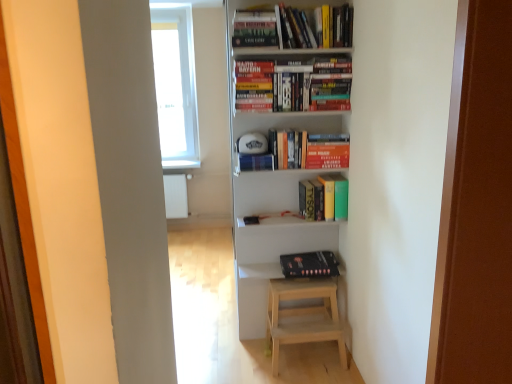
Question: Is black matte book at lower center, which appears as the 4th book when viewed from the top, at the back of hardcover books at upper center, which is counted as the first book, starting from the top?

Choices:
 (A) no
 (B) yes

Answer: (A)

Question: Does hardcover books at upper center, the 4th book from the bottom, appear on the right side of black matte book at lower center, which appears as the 4th book when viewed from the top?

Choices:
 (A) yes
 (B) no

Answer: (B)

Question: Considering the relative sizes of hardcover books at upper center, which is counted as the first book, starting from the top, and black matte book at lower center, arranged as the 1th book when ordered from the bottom, in the image provided, is hardcover books at upper center, which is counted as the first book, starting from the top, thinner than black matte book at lower center, arranged as the 1th book when ordered from the bottom,?

Choices:
 (A) yes
 (B) no

Answer: (A)

Question: Could you tell me if hardcover books at upper center, which is counted as the first book, starting from the top, is facing black matte book at lower center, arranged as the 1th book when ordered from the bottom?

Choices:
 (A) no
 (B) yes

Answer: (A)

Question: Is hardcover books at upper center, the 4th book from the bottom, located outside black matte book at lower center, which appears as the 4th book when viewed from the top?

Choices:
 (A) yes
 (B) no

Answer: (A)

Question: From a real-world perspective, is hardcover books at upper center, which is counted as the first book, starting from the top, located beneath black matte book at lower center, arranged as the 1th book when ordered from the bottom?

Choices:
 (A) no
 (B) yes

Answer: (A)

Question: Considering the relative positions of black matte book at lower center, which appears as the 4th book when viewed from the top, and hardcover books at upper center, which is the 3th book from bottom to top, in the image provided, is black matte book at lower center, which appears as the 4th book when viewed from the top, to the right of hardcover books at upper center, which is the 3th book from bottom to top, from the viewer's perspective?

Choices:
 (A) yes
 (B) no

Answer: (A)

Question: Does black matte book at lower center, which appears as the 4th book when viewed from the top, have a lesser height compared to hardcover books at upper center, which is the 3th book from bottom to top?

Choices:
 (A) no
 (B) yes

Answer: (B)

Question: Is the depth of black matte book at lower center, arranged as the 1th book when ordered from the bottom, greater than that of hardcover books at upper center, which is the 3th book from bottom to top?

Choices:
 (A) yes
 (B) no

Answer: (A)

Question: Can you confirm if black matte book at lower center, which appears as the 4th book when viewed from the top, is bigger than hardcover books at upper center, which is the 3th book from bottom to top?

Choices:
 (A) no
 (B) yes

Answer: (A)

Question: From a real-world perspective, does black matte book at lower center, arranged as the 1th book when ordered from the bottom, stand above hardcover books at upper center, marked as the 2th book in a top-to-bottom arrangement?

Choices:
 (A) yes
 (B) no

Answer: (B)

Question: Can you confirm if black matte book at lower center, which appears as the 4th book when viewed from the top, is wider than hardcover books at upper center, which is the 3th book from bottom to top?

Choices:
 (A) yes
 (B) no

Answer: (A)

Question: Is hardcover book at upper center a part of hardcover books at upper center, the 4th book from the bottom?

Choices:
 (A) yes
 (B) no

Answer: (B)